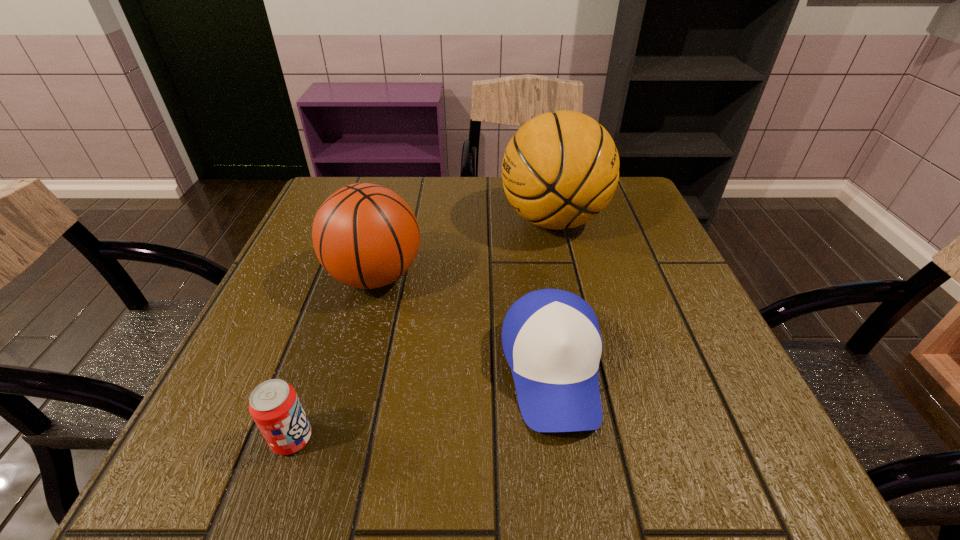
Identify the location of unoccupied area between the baseball cap and the shorter basketball. (464, 323).

The height and width of the screenshot is (540, 960). What are the coordinates of `vacant region between the soda can and the baseball cap` in the screenshot? It's located at (422, 404).

Where is `free spot between the shorter basketball and the right basketball`? The width and height of the screenshot is (960, 540). free spot between the shorter basketball and the right basketball is located at coordinates (465, 248).

Where is `vacant region between the right basketball and the soda can`? This screenshot has height=540, width=960. vacant region between the right basketball and the soda can is located at coordinates (422, 329).

Where is `blank region between the soda can and the baseball cap`? The image size is (960, 540). blank region between the soda can and the baseball cap is located at coordinates (422, 404).

Find the location of a particular element. Image resolution: width=960 pixels, height=540 pixels. free spot between the tallest object and the soda can is located at coordinates (422, 329).

Choose which object is the third nearest neighbor to the soda can. Please provide its 2D coordinates. Your answer should be formatted as a tuple, i.e. [(x, y)], where the tuple contains the x and y coordinates of a point satisfying the conditions above.

[(561, 169)]

Select which object is the third closest to the baseball cap. Please provide its 2D coordinates. Your answer should be formatted as a tuple, i.e. [(x, y)], where the tuple contains the x and y coordinates of a point satisfying the conditions above.

[(274, 405)]

The image size is (960, 540). I want to click on vacant space that satisfies the following two spatial constraints: 1. on the surface of the right basketball near the brand logo; 2. on the front-facing side of the baseball cap, so click(587, 370).

Where is `vacant space that satisfies the following two spatial constraints: 1. on the surface of the right basketball near the brand logo; 2. on the front-facing side of the baseball cap`? This screenshot has height=540, width=960. vacant space that satisfies the following two spatial constraints: 1. on the surface of the right basketball near the brand logo; 2. on the front-facing side of the baseball cap is located at coordinates (587, 370).